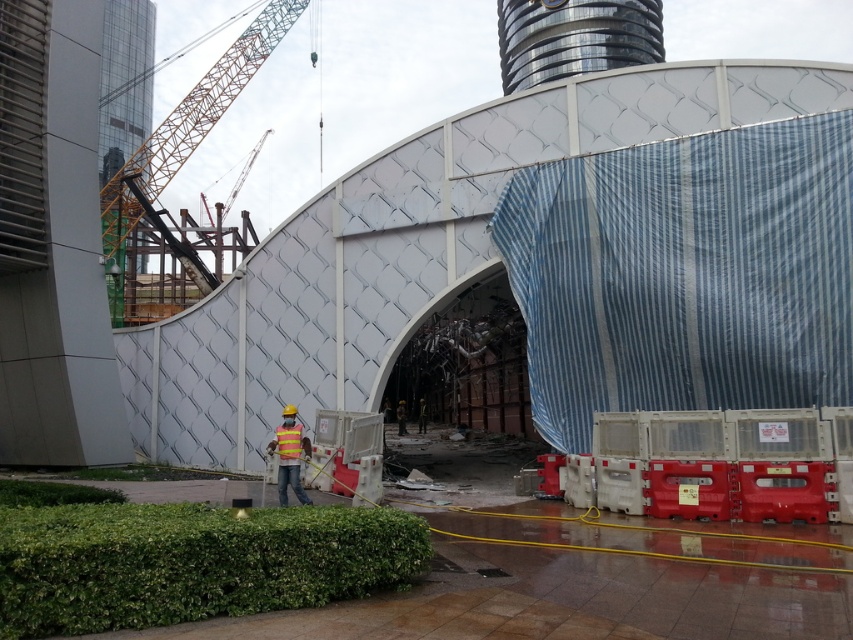
You are a construction worker standing at the edge of the construction site. You see two points marked on the ground, point (289, 433) and point (291, 458). Which point is closer to you?

Point (291, 458) is closer to you because it is less further to the camera than point (289, 433).

You are a construction inspector standing at point [289,456]. What object is located exactly at your current position?

The yellow reflective vest at center is located exactly at point [289,456].